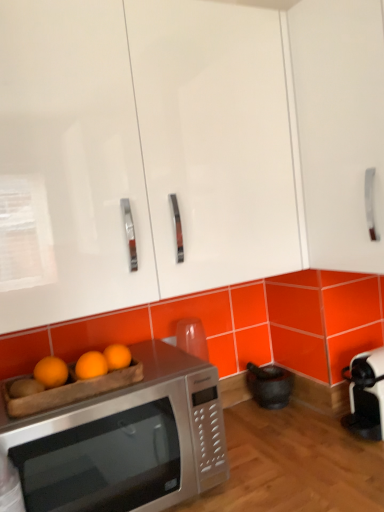
Question: Is satin silver microwave at lower left wider or thinner than orange matte wood tray at lower left?

Choices:
 (A) thin
 (B) wide

Answer: (B)

Question: Is satin silver microwave at lower left to the left or to the right of orange matte wood tray at lower left in the image?

Choices:
 (A) right
 (B) left

Answer: (A)

Question: Estimate the real-world distances between objects in this image. Which object is farther from the orange matte wood tray at lower left?

Choices:
 (A) white glossy cabinet at upper right, placed as the 1th cabinetry when sorted from right to left
 (B) satin silver microwave at lower left
 (C) white glossy cabinet at upper center, which is the 2th cabinetry from right to left

Answer: (A)

Question: Estimate the real-world distances between objects in this image. Which object is closer to the white glossy cabinet at upper right, placed as the 1th cabinetry when sorted from right to left?

Choices:
 (A) orange matte wood tray at lower left
 (B) satin silver microwave at lower left
 (C) white glossy cabinet at upper center, which is counted as the 1th cabinetry, starting from the left

Answer: (C)